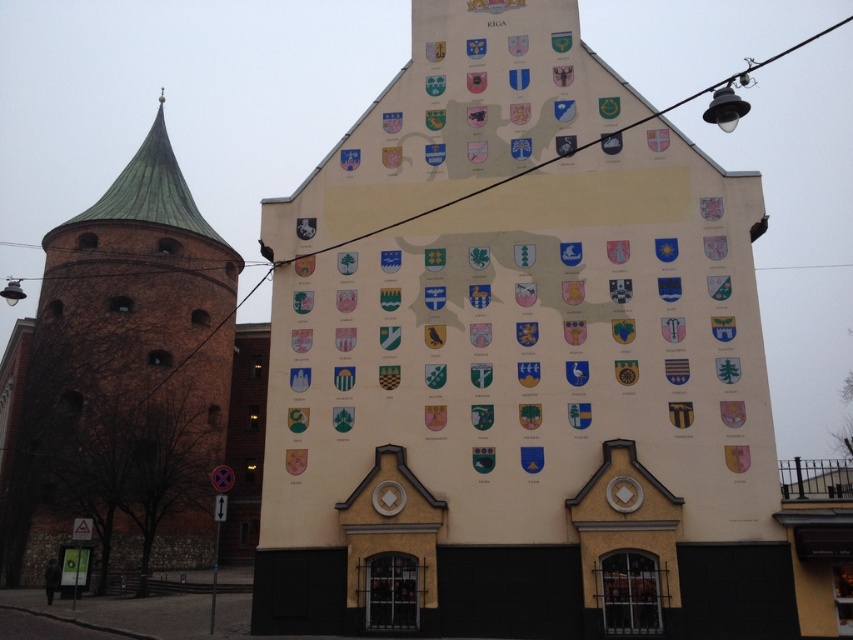
You are an architect examining the historical building. You need to determine the spatial relationship between the white painted wall at center and the brown brick tower at left. Which one is positioned higher relative to the other?

The white painted wall at center is located above the brown brick tower at left, meaning it is positioned higher.

You are an architect examining the historical building. You need to determine the spatial relationship between the white painted wall at center and the brown brick tower at left. Which object is located to the right of the other?

The white painted wall at center is positioned on the right side of brown brick tower at left, meaning the white painted wall at center is to the right of the brown brick tower at left.

You are an architect examining the historical building. You need to determine which structure, the white painted wall at center or the brown brick tower at left, has a smaller width. Based on the scene, which one would you choose?

The white painted wall at center is thinner than the brown brick tower at left, so the white painted wall at center has a smaller width.